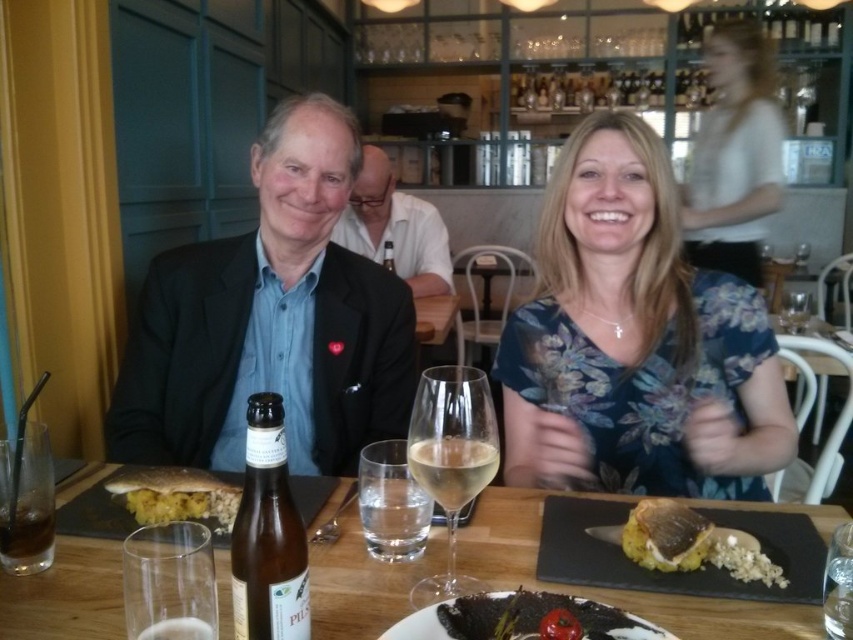
Who is shorter, translucent glass bottle at center or transparent glass at table center?

transparent glass at table center

Can you confirm if translucent glass bottle at center is positioned to the left of transparent glass at table center?

In fact, translucent glass bottle at center is to the right of transparent glass at table center.

Does point (264, 493) lie behind point (157, 524)?

No.

Find the location of a particular element. translucent glass bottle at center is located at coordinates (268, 534).

Where is `white floral blouse at upper center`? The height and width of the screenshot is (640, 853). white floral blouse at upper center is located at coordinates (734, 154).

The width and height of the screenshot is (853, 640). What do you see at coordinates (734, 154) in the screenshot?
I see `white floral blouse at upper center` at bounding box center [734, 154].

Is point (743, 212) less distant than point (386, 266)?

No, it is behind (386, 266).

Find the location of `white floral blouse at upper center`. white floral blouse at upper center is located at coordinates (734, 154).

Between floral print blouse at center and white floral blouse at upper center, which one appears on the right side from the viewer's perspective?

white floral blouse at upper center

Can you confirm if floral print blouse at center is positioned to the left of white floral blouse at upper center?

Correct, you'll find floral print blouse at center to the left of white floral blouse at upper center.

Is point (611, 474) farther from viewer compared to point (752, 90)?

No, (611, 474) is closer to viewer.

Locate an element on the screen. The height and width of the screenshot is (640, 853). floral print blouse at center is located at coordinates (637, 339).